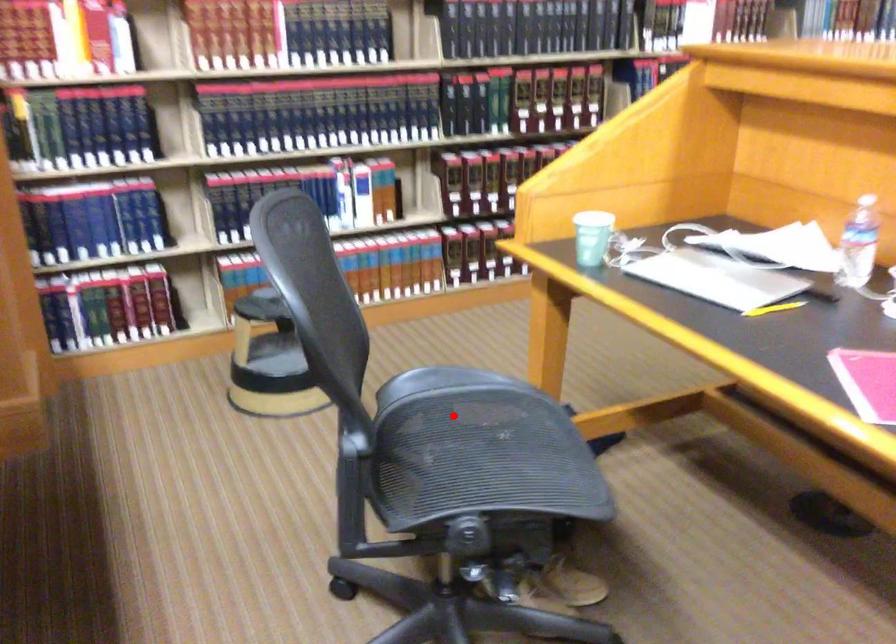
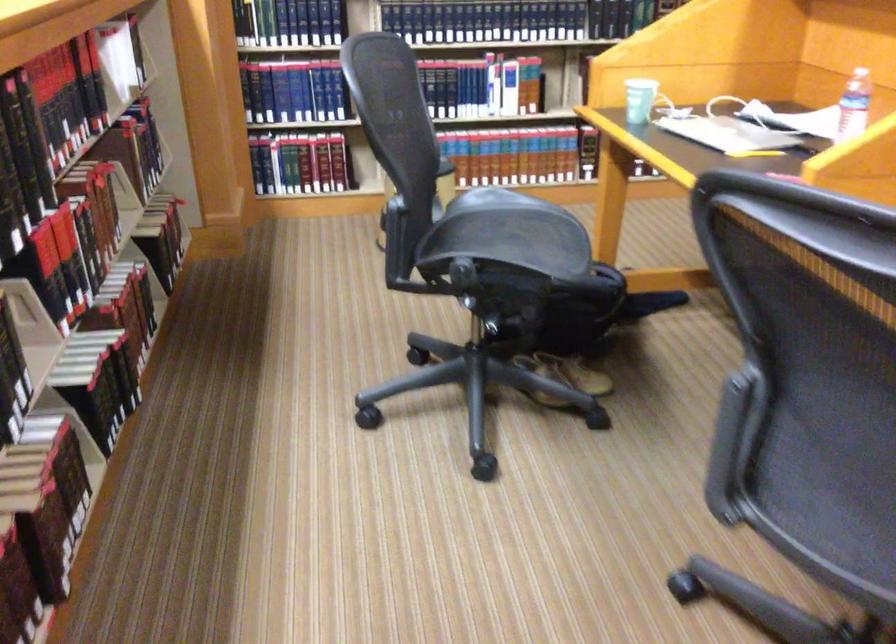
Question: I am providing you with two images of the same scene from different viewpoints. A red point is marked on the first image. Is the red point's position out of view in image 2?

Choices:
 (A) Yes
 (B) No

Answer: (B)